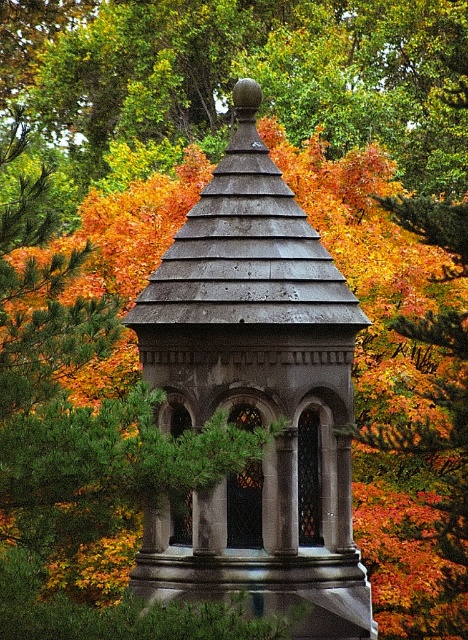
In the scene shown: You are standing in front of the gazebo and notice two points marked on its structure. The first point is at coordinates point (306, 385) and the second is at point (146, 77). Which of these points is nearer to your current position?

Point (306, 385) is closer to the viewer than point (146, 77), so the first point is nearer to your current position.

You are standing in an autumn forest and see the gray stone gazebo at center and the autumn leaves at center. Which object is positioned to the right?

The autumn leaves at center are positioned to the right of the gray stone gazebo at center.

You are standing in an autumn forest and see the gray stone gazebo at center and autumn leaves at center. Which object is taller?

The gray stone gazebo at center is much taller than the autumn leaves at center.